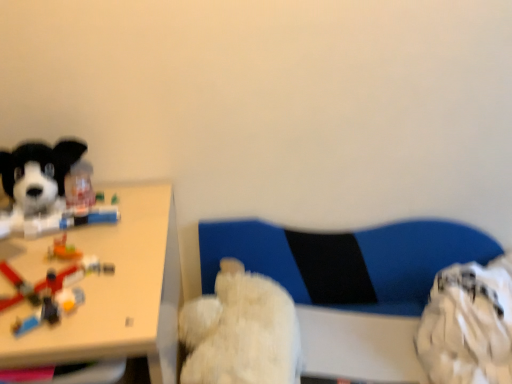
Where is `blank area beneath soft plush dog at left, which is the first dog in top-to-bottom order (from a real-world perspective)`? This screenshot has height=384, width=512. blank area beneath soft plush dog at left, which is the first dog in top-to-bottom order (from a real-world perspective) is located at coordinates (62, 215).